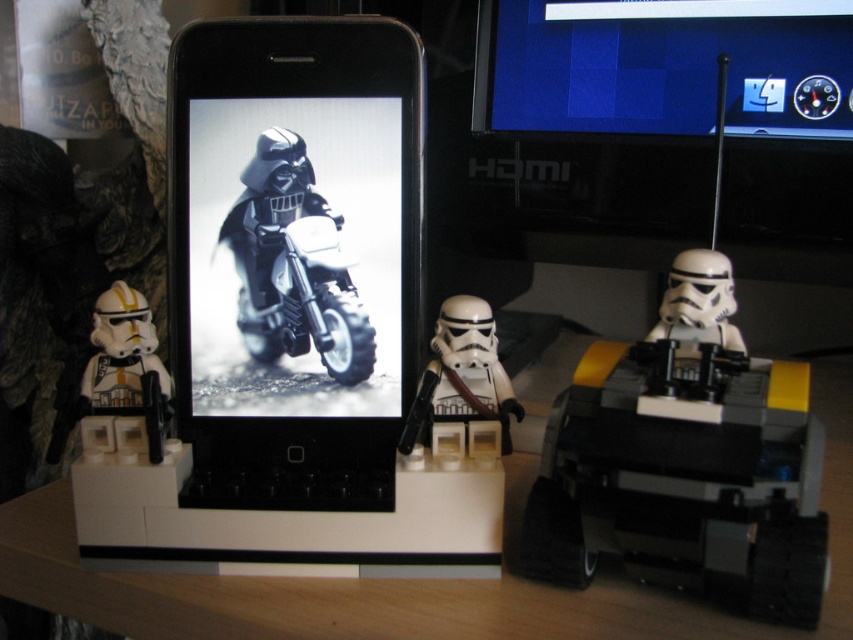
Describe the element at coordinates (685, 458) in the screenshot. This screenshot has height=640, width=853. I see `white plastic stormtrooper helmet at center` at that location.

Can you confirm if white plastic stormtrooper helmet at center is taller than white matte stormtrooper at left?

Indeed, white plastic stormtrooper helmet at center has a greater height compared to white matte stormtrooper at left.

Locate an element on the screen. This screenshot has width=853, height=640. white plastic stormtrooper helmet at center is located at coordinates (685, 458).

Locate an element on the screen. Image resolution: width=853 pixels, height=640 pixels. white plastic stormtrooper helmet at center is located at coordinates (685, 458).

Between white plastic stormtrooper at center and white matte stormtrooper helmet at center, which one has more height?

white plastic stormtrooper at center is taller.

Identify the location of white plastic stormtrooper at center. (461, 376).

Identify the location of white plastic stormtrooper at center. This screenshot has width=853, height=640. (461, 376).

Is white plastic stormtrooper at center shorter than white matte stormtrooper at left?

Yes, white plastic stormtrooper at center is shorter than white matte stormtrooper at left.

Which is in front, point (440, 324) or point (114, 387)?

Point (440, 324) is in front.

Who is more forward, (440, 410) or (131, 317)?

Point (440, 410)

I want to click on white plastic stormtrooper at center, so click(x=461, y=376).